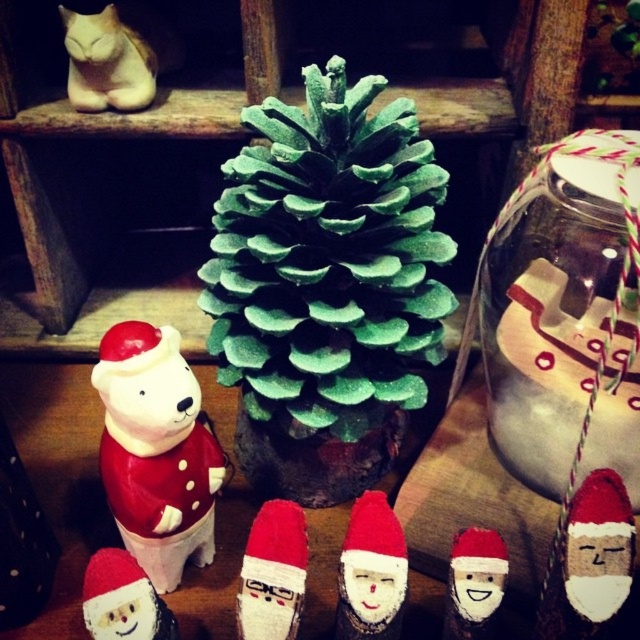
Does matte wood santa at center lie behind wooden santa at center?

That is False.

This screenshot has width=640, height=640. Find the location of `matte wood santa at center`. matte wood santa at center is located at coordinates (371, 572).

The image size is (640, 640). I want to click on matte wood santa at center, so click(x=371, y=572).

Identify the location of green glittery pinecone at center. This screenshot has height=640, width=640. (326, 285).

Consider the image. Can you confirm if green glittery pinecone at center is wider than wooden santa at center?

Yes, green glittery pinecone at center is wider than wooden santa at center.

Does point (369, 131) come behind point (508, 561)?

That is True.

This screenshot has width=640, height=640. Find the location of `green glittery pinecone at center`. green glittery pinecone at center is located at coordinates coord(326,285).

Is green glittery pinecone at center behind matte wood santa at center?

Yes, green glittery pinecone at center is behind matte wood santa at center.

Who is more forward, (x=280, y=228) or (x=355, y=589)?

Point (x=355, y=589) is more forward.

Locate an element on the screen. green glittery pinecone at center is located at coordinates (326, 285).